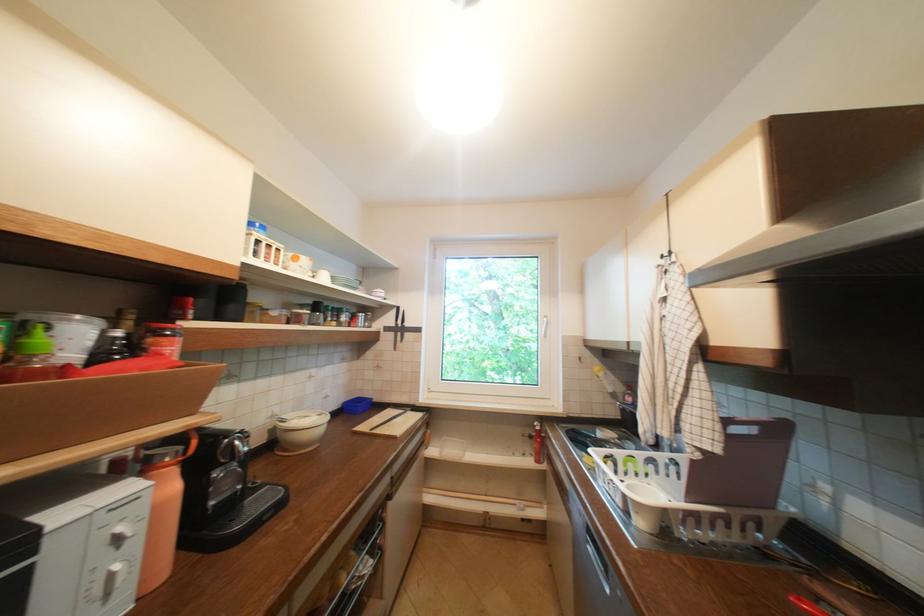
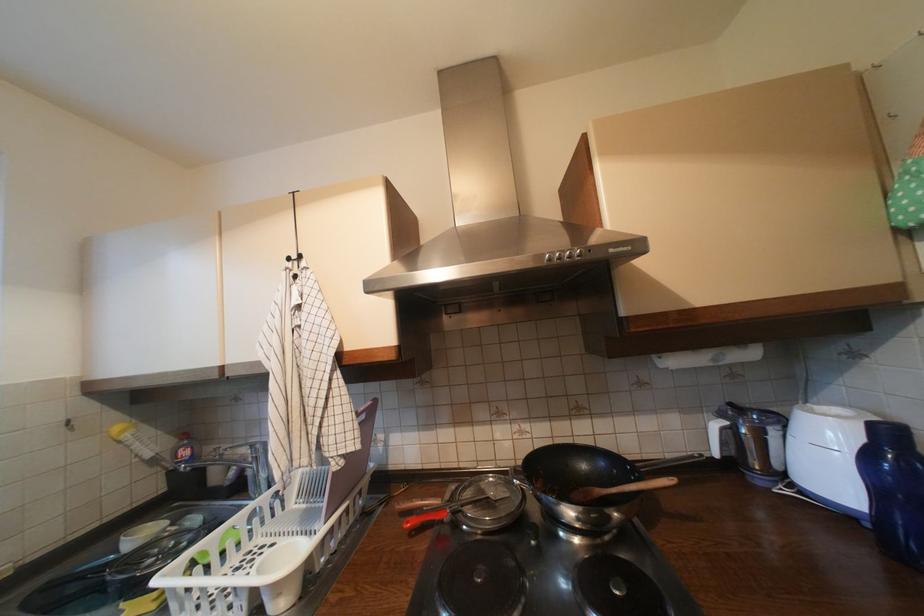
Locate, in the second image, the point that corresponds to point 671,257 in the first image.

(297, 260)